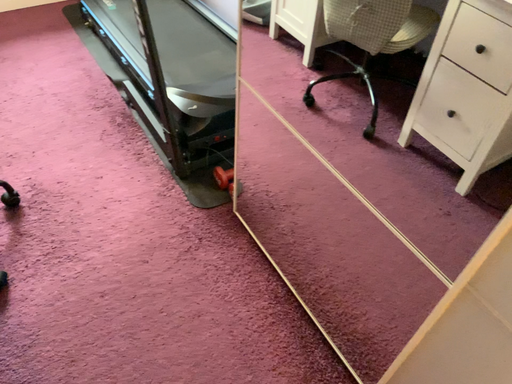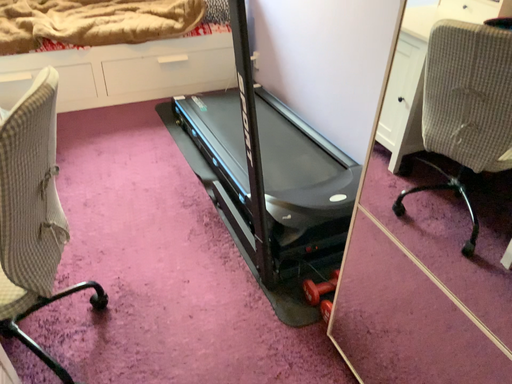
Question: How did the camera likely rotate when shooting the video?

Choices:
 (A) rotated upward
 (B) rotated downward

Answer: (A)